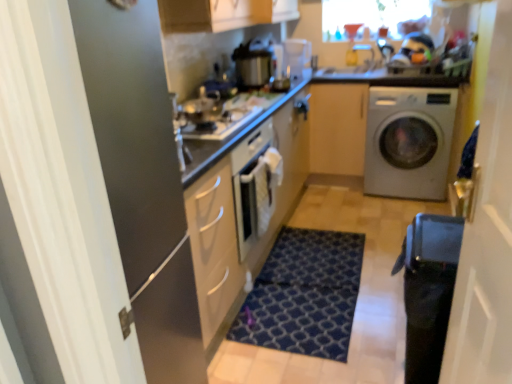
Question: From a real-world perspective, is transparent glass window screen at upper center positioned above or below satin silver washing machine at right?

Choices:
 (A) below
 (B) above

Answer: (B)

Question: In terms of width, does transparent glass window screen at upper center look wider or thinner when compared to satin silver washing machine at right?

Choices:
 (A) wide
 (B) thin

Answer: (B)

Question: Considering the real-world distances, which object is closest to the matte wood cabinet at center?

Choices:
 (A) matte black screen door at left, acting as the first screen door starting from the left
 (B) transparent glass window screen at upper center
 (C) black glossy water heater at lower right
 (D) white glossy countertop at upper center
 (E) metallic silver pot at center

Answer: (D)

Question: Estimate the real-world distances between objects in this image. Which object is closer to the white glossy countertop at upper center?

Choices:
 (A) white plastic coffee machine at upper center
 (B) matte wood cabinet at center
 (C) transparent plastic screen door at right, the 2th screen door from the left
 (D) dark blue textured rug at center
 (E) matte black screen door at left, the 2th screen door when ordered from right to left

Answer: (B)